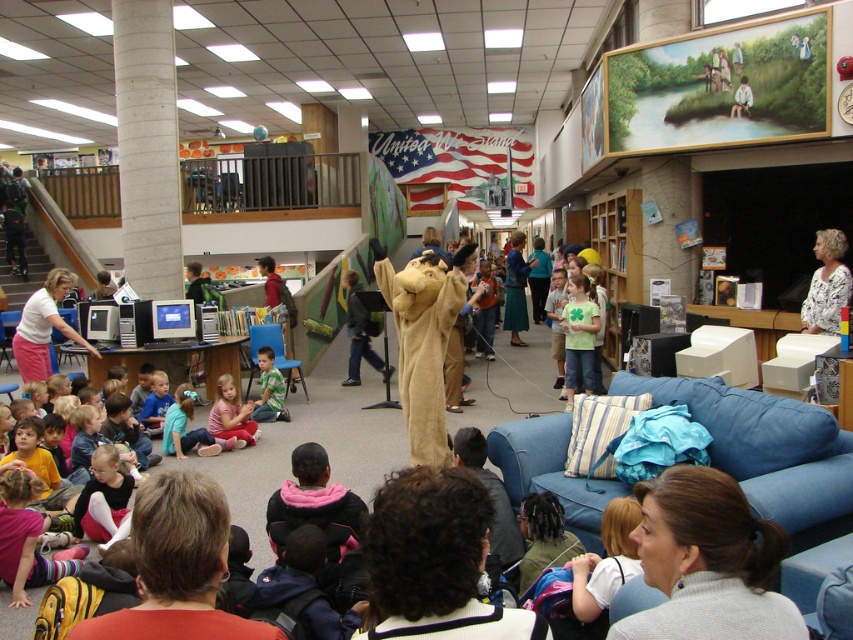
You are a photographer standing at the back of the room. You want to take a photo that includes both the pink fabric pants at lower center and the green matte shirt at lower center. Which object should you focus on first to ensure both are in clear view?

The pink fabric pants at lower center is closer to the viewer than the green matte shirt at lower center. To ensure both are in clear view, focus on the pink fabric pants at lower center first, as it is closer, and adjust the depth of field to include the green matte shirt at lower center in the background.

You are standing at the center of the room and want to move towards the two points marked in the image. Which point, point (256, 433) or point (270, 392), is closer to you?

Point (256, 433) is closer to the camera than point (270, 392), so it is closer to you.

Looking at this image, you are organizing a costume party and need to ensure that all outfits fit through a narrow doorway. Given the pink fabric pants at lower center and the green matte shirt at lower center, which item has a wider width that might require extra caution when moving through tight spaces?

The pink fabric pants at lower center has a larger width than the green matte shirt at lower center, so it requires more caution when moving through tight spaces.